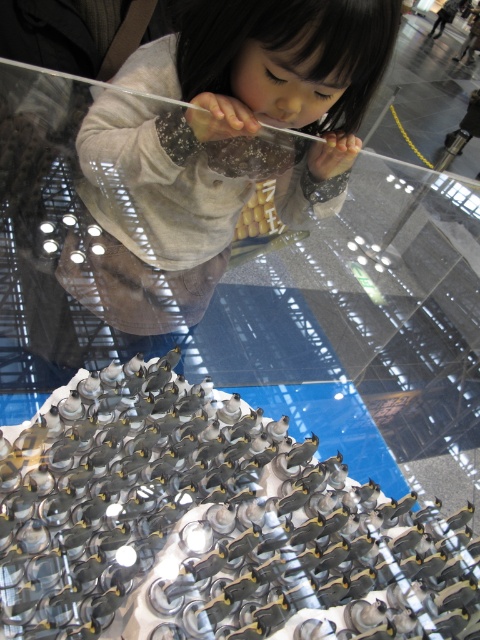
You are an architect designing a new exhibit layout. The metallic silver sculpture at center and the matte gray hoodie at upper center are part of the display. To ensure visitors can view both items comfortably, which object should be placed higher to avoid obstruction?

The matte gray hoodie at upper center should be placed higher since the metallic silver sculpture at center is positioned under it, allowing the hoodie to be seen without blocking the sculpture below.

You are a security guard in the museum and need to determine if the metallic silver sculpture at center can fit inside the matte gray hoodie at upper center. Based on their sizes, can it?

The metallic silver sculpture at center is smaller than the matte gray hoodie at upper center, so it can fit inside.